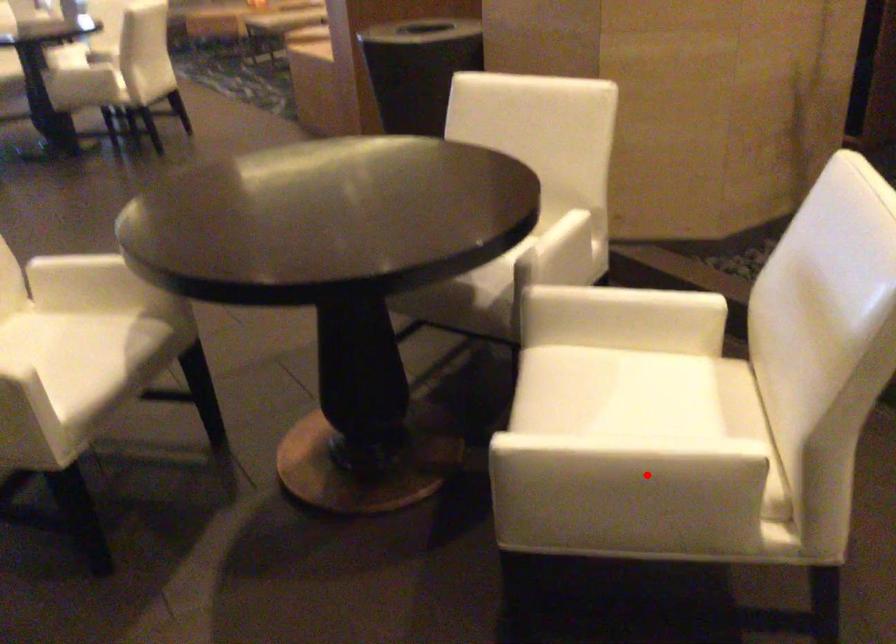
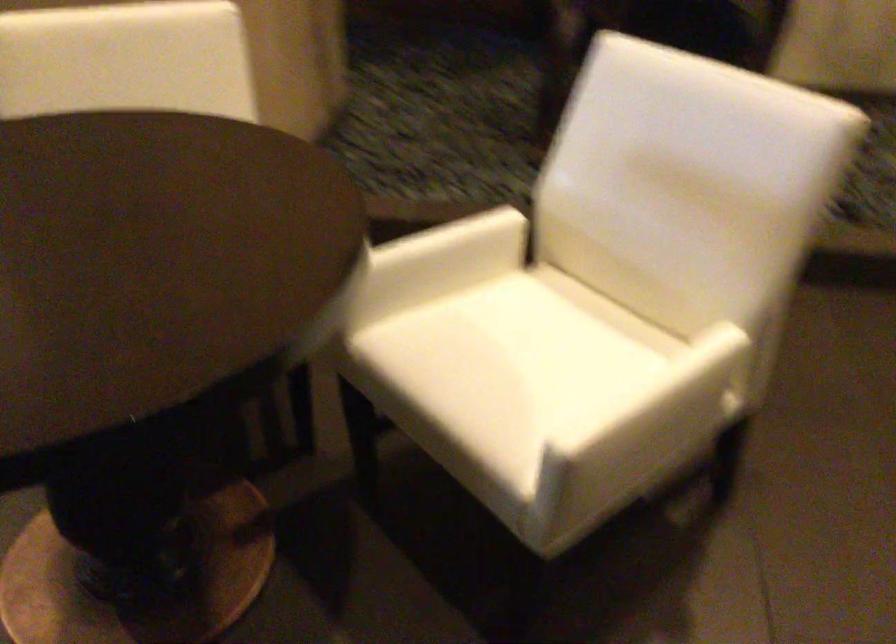
Find the pixel in the second image that matches the highlighted location in the first image.

(684, 402)